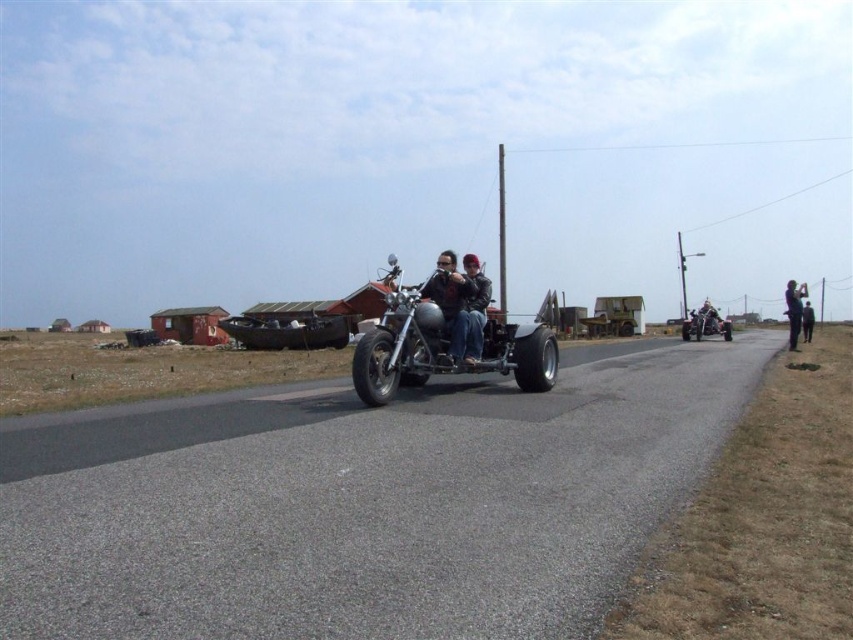
You are a traveler who wants to know which jacket is closer to the left side of the image. You see the leather jacket at center and the dark gray jacket at right. Which one is positioned more to the left?

The leather jacket at center is positioned more to the left than the dark gray jacket at right.

You are a traveler planning to store a camping backpack in the available space between the rustic wooden sidecar at center and the dark gray fabric jacket at right. Based on the scene, can you determine if the backpack will fit? Please explain your reasoning.

The rustic wooden sidecar at center is wider than the dark gray fabric jacket at right. Therefore, the space between them might be sufficient to store the camping backpack, provided the backpack dimensions align with the available width.